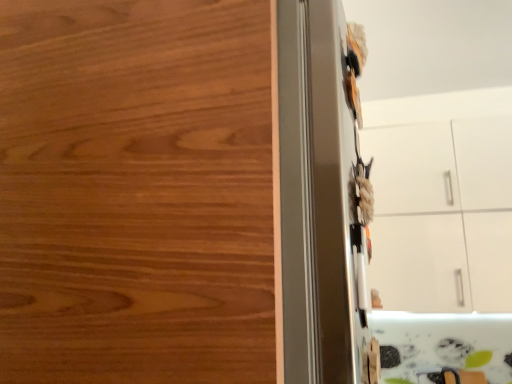
Describe the element at coordinates (322, 197) in the screenshot. I see `metallic silver fridge at right` at that location.

I want to click on metallic silver fridge at right, so click(x=322, y=197).

The height and width of the screenshot is (384, 512). Find the location of `metallic silver fridge at right`. metallic silver fridge at right is located at coordinates (322, 197).